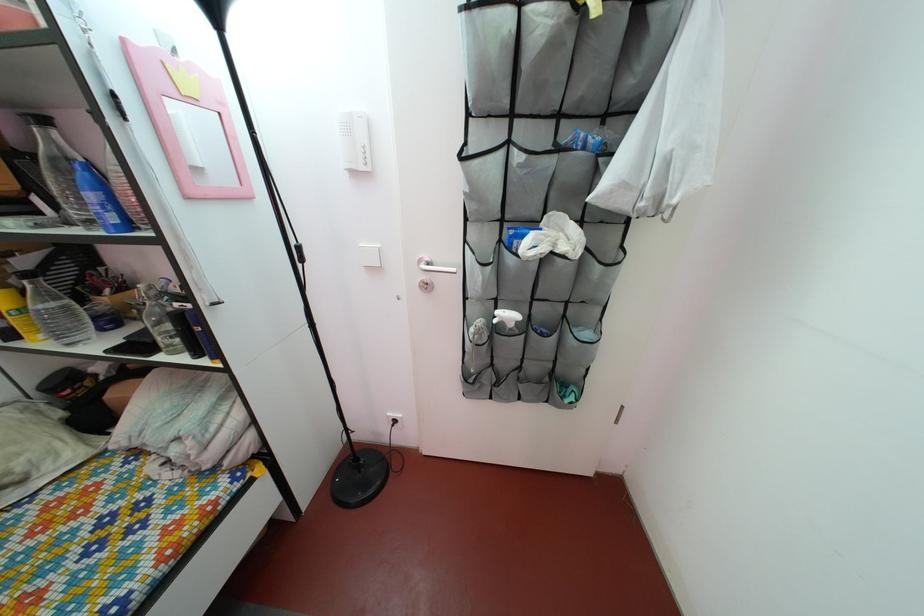
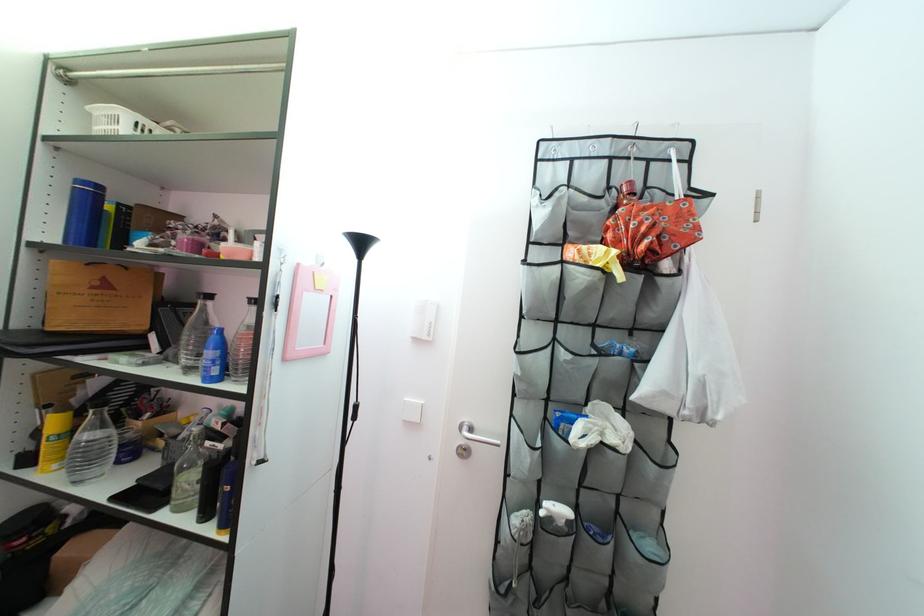
Question: Based on the continuous images, in which direction is the camera rotating? Reply with the corresponding letter.

Choices:
 (A) Left
 (B) Right
 (C) Up
 (D) Down

Answer: (C)